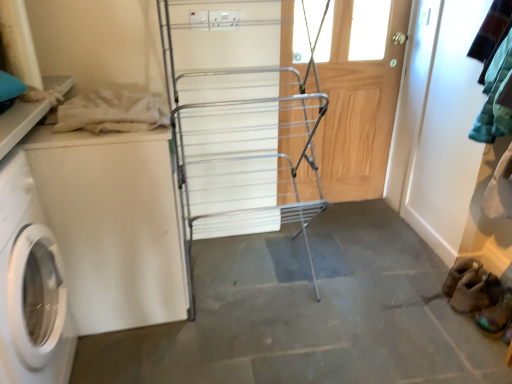
Identify the location of free space in front of wooden screen door at center. This screenshot has height=384, width=512. pyautogui.click(x=334, y=220).